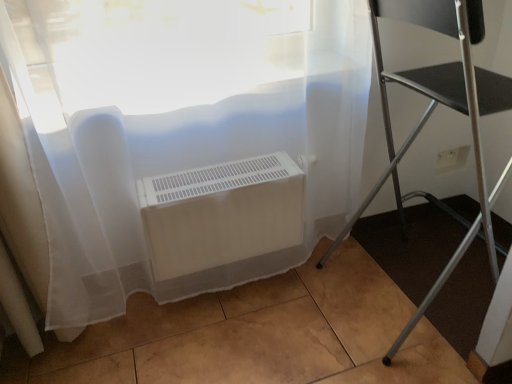
This screenshot has height=384, width=512. What do you see at coordinates (433, 110) in the screenshot?
I see `black plastic chair at right` at bounding box center [433, 110].

The image size is (512, 384). In order to click on black plastic chair at right in this screenshot , I will do `click(433, 110)`.

At what (x,y) coordinates should I click in order to perform the action: click on black plastic chair at right. Please return your answer as a coordinate pair (x, y). Looking at the image, I should click on (433, 110).